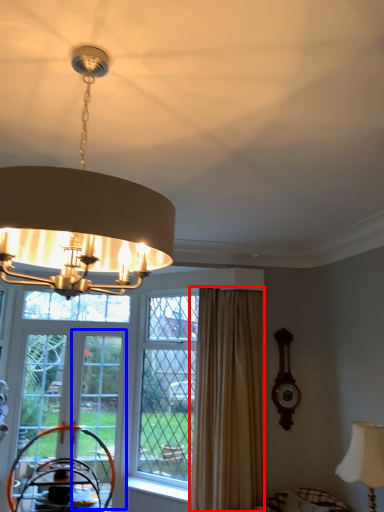
Question: Among these objects, which one is farthest to the camera, curtain (highlighted by a red box) or screen door (highlighted by a blue box)?

Choices:
 (A) curtain
 (B) screen door

Answer: (B)